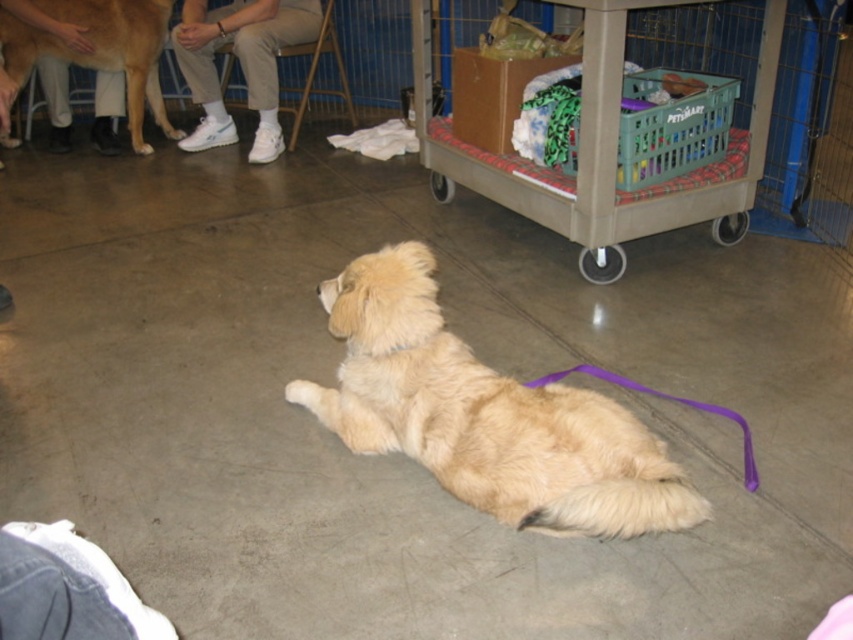
What is located at the coordinates point (485, 413) in the image?

The golden fur dog at center is located at point (485, 413).

In the scene shown: You are standing in the room and want to place a small toy in the plastic crate at center. Where should you aim to place the toy so it lands inside the crate?

The plastic crate at center is located at point coordinates [601,147], so aim for that coordinate to place the toy inside the crate.